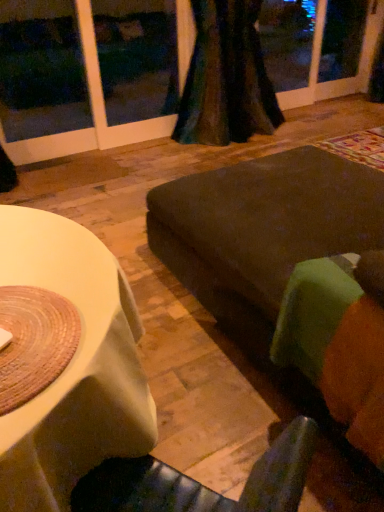
Describe the element at coordinates (297, 267) in the screenshot. I see `dark brown fabric couch at center, placed as the second couch when sorted from front to back` at that location.

Identify the location of velvet dark green curtain at upper center. The height and width of the screenshot is (512, 384). (226, 78).

Locate an element on the screen. The width and height of the screenshot is (384, 512). dark brown fabric couch at center, which appears as the 1th couch when viewed from the back is located at coordinates (297, 267).

From a real-world perspective, is green fabric couch at lower right, the first couch in the front-to-back sequence, above or below dark brown fabric couch at center, which appears as the 1th couch when viewed from the back?

From a real-world perspective, green fabric couch at lower right, the first couch in the front-to-back sequence, is physically above dark brown fabric couch at center, which appears as the 1th couch when viewed from the back.

Which is more to the left, green fabric couch at lower right, the first couch in the front-to-back sequence, or dark brown fabric couch at center, placed as the second couch when sorted from front to back?

green fabric couch at lower right, the first couch in the front-to-back sequence, is more to the left.

Is point (298, 352) more distant than point (271, 357)?

No, it is not.

Considering the sizes of objects green fabric couch at lower right, the second couch in the back-to-front sequence, and dark brown fabric couch at center, which appears as the 1th couch when viewed from the back, in the image provided, who is thinner, green fabric couch at lower right, the second couch in the back-to-front sequence, or dark brown fabric couch at center, which appears as the 1th couch when viewed from the back,?

With smaller width is green fabric couch at lower right, the second couch in the back-to-front sequence.

Is velvet dark green curtain at upper center far from green fabric couch at lower right, the first couch in the front-to-back sequence?

Absolutely, velvet dark green curtain at upper center is distant from green fabric couch at lower right, the first couch in the front-to-back sequence.

From the image's perspective, is velvet dark green curtain at upper center located beneath green fabric couch at lower right, the second couch in the back-to-front sequence?

Incorrect, from the image's perspective, velvet dark green curtain at upper center is higher than green fabric couch at lower right, the second couch in the back-to-front sequence.

Which of these two, velvet dark green curtain at upper center or green fabric couch at lower right, the first couch in the front-to-back sequence, is wider?

With larger width is green fabric couch at lower right, the first couch in the front-to-back sequence.

Based on the photo, is velvet dark green curtain at upper center facing towards green fabric couch at lower right, the second couch in the back-to-front sequence?

No, velvet dark green curtain at upper center is not turned towards green fabric couch at lower right, the second couch in the back-to-front sequence.

Is green fabric couch at lower right, the first couch in the front-to-back sequence, turned away from velvet dark green curtain at upper center?

No, green fabric couch at lower right, the first couch in the front-to-back sequence,'s orientation is not away from velvet dark green curtain at upper center.

Would you say velvet dark green curtain at upper center is part of green fabric couch at lower right, the first couch in the front-to-back sequence,'s contents?

No.

Considering their positions, is green fabric couch at lower right, the second couch in the back-to-front sequence, located in front of or behind velvet dark green curtain at upper center?

In the image, green fabric couch at lower right, the second couch in the back-to-front sequence, appears in front of velvet dark green curtain at upper center.

Which is more to the right, green fabric couch at lower right, the first couch in the front-to-back sequence, or velvet dark green curtain at upper center?

Positioned to the right is green fabric couch at lower right, the first couch in the front-to-back sequence.

Image resolution: width=384 pixels, height=512 pixels. In the image, there is a green fabric couch at lower right, the second couch in the back-to-front sequence. Identify the location of couch above it (from the image's perspective). (297, 267).

Is dark brown fabric couch at center, which appears as the 1th couch when viewed from the back, positioned with its back to green fabric couch at lower right, the first couch in the front-to-back sequence?

Yes, dark brown fabric couch at center, which appears as the 1th couch when viewed from the back, is facing away from green fabric couch at lower right, the first couch in the front-to-back sequence.

Between dark brown fabric couch at center, which appears as the 1th couch when viewed from the back, and green fabric couch at lower right, the second couch in the back-to-front sequence, which one has less height?

With less height is green fabric couch at lower right, the second couch in the back-to-front sequence.

Is dark brown fabric couch at center, placed as the second couch when sorted from front to back, outside of green fabric couch at lower right, the second couch in the back-to-front sequence?

dark brown fabric couch at center, placed as the second couch when sorted from front to back, is positioned outside green fabric couch at lower right, the second couch in the back-to-front sequence.

Considering the positions of objects dark brown fabric couch at center, placed as the second couch when sorted from front to back, and velvet dark green curtain at upper center in the image provided, who is behind, dark brown fabric couch at center, placed as the second couch when sorted from front to back, or velvet dark green curtain at upper center?

velvet dark green curtain at upper center is behind.

How distant is dark brown fabric couch at center, which appears as the 1th couch when viewed from the back, from velvet dark green curtain at upper center?

dark brown fabric couch at center, which appears as the 1th couch when viewed from the back, is 6.91 feet from velvet dark green curtain at upper center.

From a real-world perspective, is dark brown fabric couch at center, which appears as the 1th couch when viewed from the back, on top of velvet dark green curtain at upper center?

No.

Which is closer to the camera, (345, 180) or (241, 57)?

Positioned in front is point (345, 180).

From a real-world perspective, is velvet dark green curtain at upper center positioned under dark brown fabric couch at center, which appears as the 1th couch when viewed from the back, based on gravity?

Actually, velvet dark green curtain at upper center is physically above dark brown fabric couch at center, which appears as the 1th couch when viewed from the back, in the real world.

Which is more to the right, velvet dark green curtain at upper center or dark brown fabric couch at center, which appears as the 1th couch when viewed from the back?

dark brown fabric couch at center, which appears as the 1th couch when viewed from the back, is more to the right.

Is velvet dark green curtain at upper center wider or thinner than dark brown fabric couch at center, placed as the second couch when sorted from front to back?

velvet dark green curtain at upper center is thinner than dark brown fabric couch at center, placed as the second couch when sorted from front to back.

Is dark brown fabric couch at center, which appears as the 1th couch when viewed from the back, a part of velvet dark green curtain at upper center?

No, dark brown fabric couch at center, which appears as the 1th couch when viewed from the back, is not inside velvet dark green curtain at upper center.

Identify the location of couch positioned vertically above the dark brown fabric couch at center, which appears as the 1th couch when viewed from the back (from a real-world perspective). point(336,346).

Find the location of `the 2nd couch below when counting from the velvet dark green curtain at upper center (from the image's perspective)`. the 2nd couch below when counting from the velvet dark green curtain at upper center (from the image's perspective) is located at coordinates (336, 346).

In the scene shown: Considering their positions, is dark brown fabric couch at center, placed as the second couch when sorted from front to back, positioned further to green fabric couch at lower right, the first couch in the front-to-back sequence, than velvet dark green curtain at upper center?

velvet dark green curtain at upper center.

Based on their spatial positions, is velvet dark green curtain at upper center or dark brown fabric couch at center, placed as the second couch when sorted from front to back, further from green fabric couch at lower right, the second couch in the back-to-front sequence?

velvet dark green curtain at upper center.

Considering their positions, is green fabric couch at lower right, the first couch in the front-to-back sequence, positioned further to velvet dark green curtain at upper center than dark brown fabric couch at center, placed as the second couch when sorted from front to back?

Based on the image, green fabric couch at lower right, the first couch in the front-to-back sequence, appears to be further to velvet dark green curtain at upper center.

Based on their spatial positions, is velvet dark green curtain at upper center or green fabric couch at lower right, the first couch in the front-to-back sequence, further from dark brown fabric couch at center, which appears as the 1th couch when viewed from the back?

The object further to dark brown fabric couch at center, which appears as the 1th couch when viewed from the back, is velvet dark green curtain at upper center.

Looking at this image, considering their positions, is dark brown fabric couch at center, which appears as the 1th couch when viewed from the back, positioned closer to velvet dark green curtain at upper center than green fabric couch at lower right, the first couch in the front-to-back sequence?

dark brown fabric couch at center, which appears as the 1th couch when viewed from the back, is closer to velvet dark green curtain at upper center.

In the scene shown: Considering their positions, is green fabric couch at lower right, the first couch in the front-to-back sequence, positioned further to dark brown fabric couch at center, which appears as the 1th couch when viewed from the back, than velvet dark green curtain at upper center?

Based on the image, velvet dark green curtain at upper center appears to be further to dark brown fabric couch at center, which appears as the 1th couch when viewed from the back.

Locate an element on the screen. Image resolution: width=384 pixels, height=512 pixels. couch positioned between green fabric couch at lower right, the first couch in the front-to-back sequence, and velvet dark green curtain at upper center from near to far is located at coordinates (297, 267).